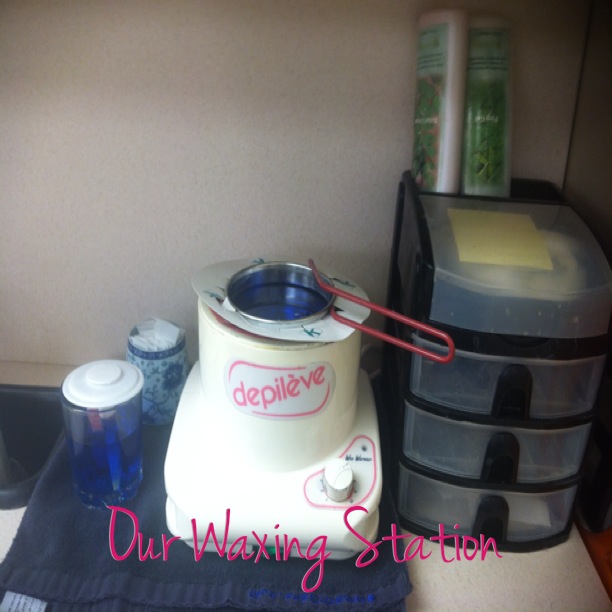
Where is `sink`? The height and width of the screenshot is (612, 612). sink is located at coordinates (162, 374).